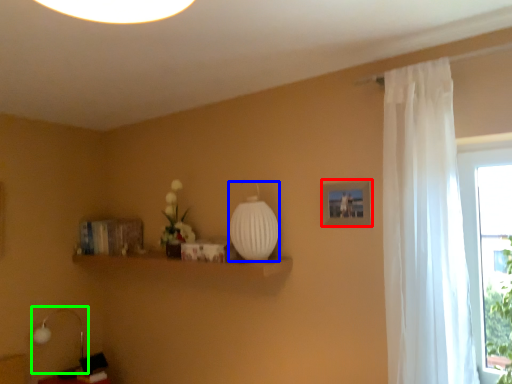
Question: Which object is positioned farthest from picture frame (highlighted by a red box)? Select from glass vase (highlighted by a blue box) and table lamp (highlighted by a green box).

Choices:
 (A) glass vase
 (B) table lamp

Answer: (B)